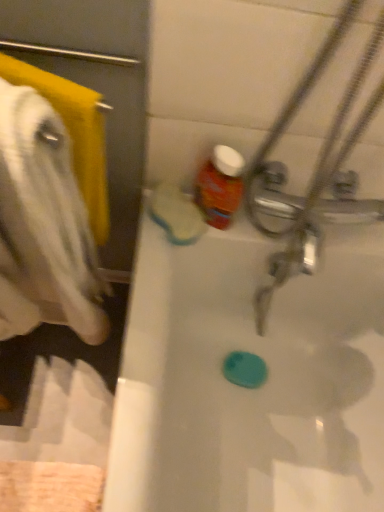
Question: Can you confirm if white glossy bathtub at center is smaller than matte plastic bottle at upper center?

Choices:
 (A) no
 (B) yes

Answer: (A)

Question: Is white glossy bathtub at center oriented away from matte plastic bottle at upper center?

Choices:
 (A) no
 (B) yes

Answer: (A)

Question: From the image's perspective, is white glossy bathtub at center located above matte plastic bottle at upper center?

Choices:
 (A) yes
 (B) no

Answer: (B)

Question: Is white glossy bathtub at center taller than matte plastic bottle at upper center?

Choices:
 (A) yes
 (B) no

Answer: (A)

Question: Is white glossy bathtub at center further to the viewer compared to matte plastic bottle at upper center?

Choices:
 (A) yes
 (B) no

Answer: (B)

Question: Is the depth of white glossy bathtub at center less than that of matte plastic bottle at upper center?

Choices:
 (A) yes
 (B) no

Answer: (A)

Question: From a real-world perspective, is white glossy bathtub at center on top of white soft towel at left?

Choices:
 (A) no
 (B) yes

Answer: (A)

Question: Is white glossy bathtub at center not inside white soft towel at left?

Choices:
 (A) no
 (B) yes

Answer: (B)

Question: Is white glossy bathtub at center smaller than white soft towel at left?

Choices:
 (A) yes
 (B) no

Answer: (B)

Question: Is white glossy bathtub at center positioned behind white soft towel at left?

Choices:
 (A) yes
 (B) no

Answer: (A)

Question: Considering the relative positions of white glossy bathtub at center and white soft towel at left in the image provided, is white glossy bathtub at center to the left of white soft towel at left from the viewer's perspective?

Choices:
 (A) no
 (B) yes

Answer: (A)

Question: Does white glossy bathtub at center have a lesser height compared to white soft towel at left?

Choices:
 (A) yes
 (B) no

Answer: (B)

Question: Is white soft towel at left located within matte plastic bottle at upper center?

Choices:
 (A) no
 (B) yes

Answer: (A)